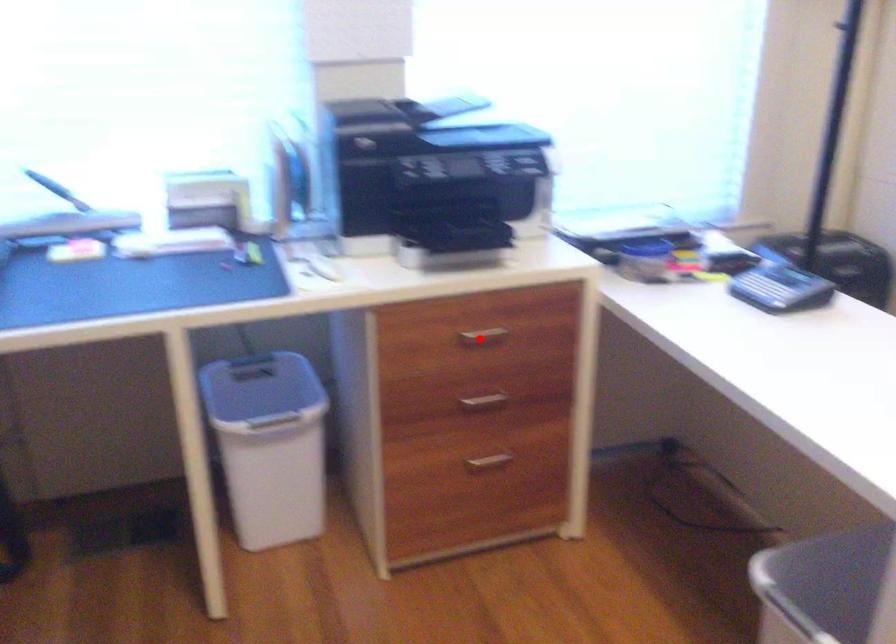
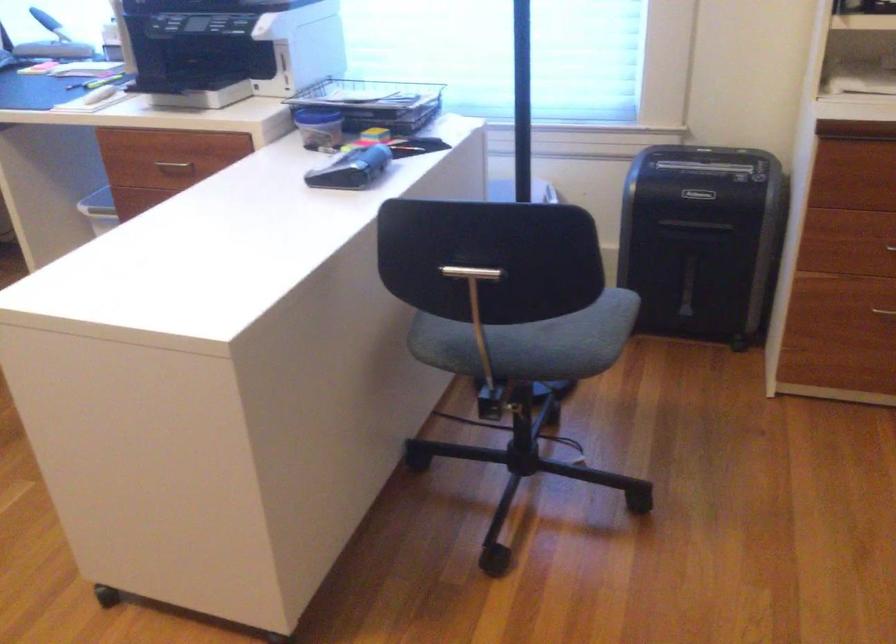
The point at the highlighted location is marked in the first image. Where is the corresponding point in the second image?

(174, 165)